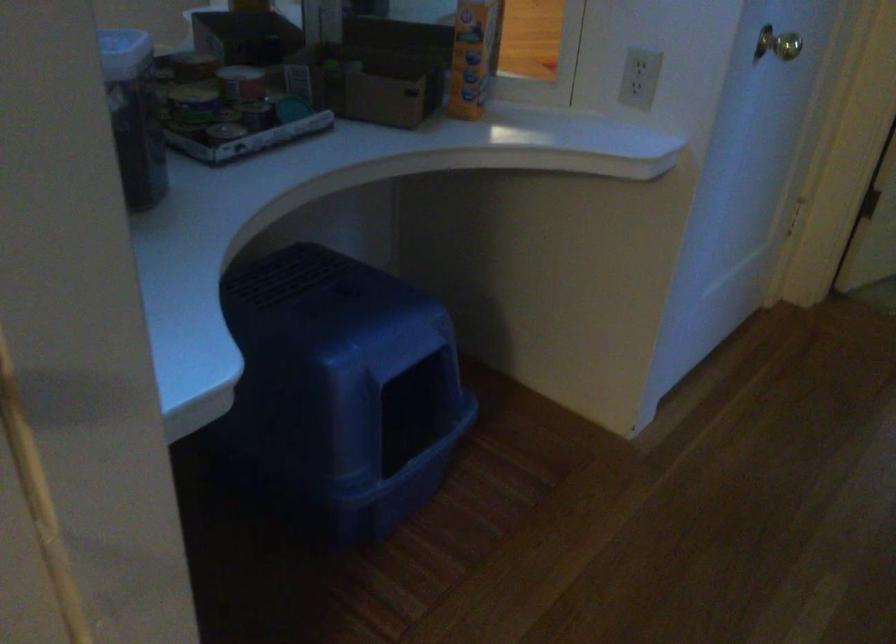
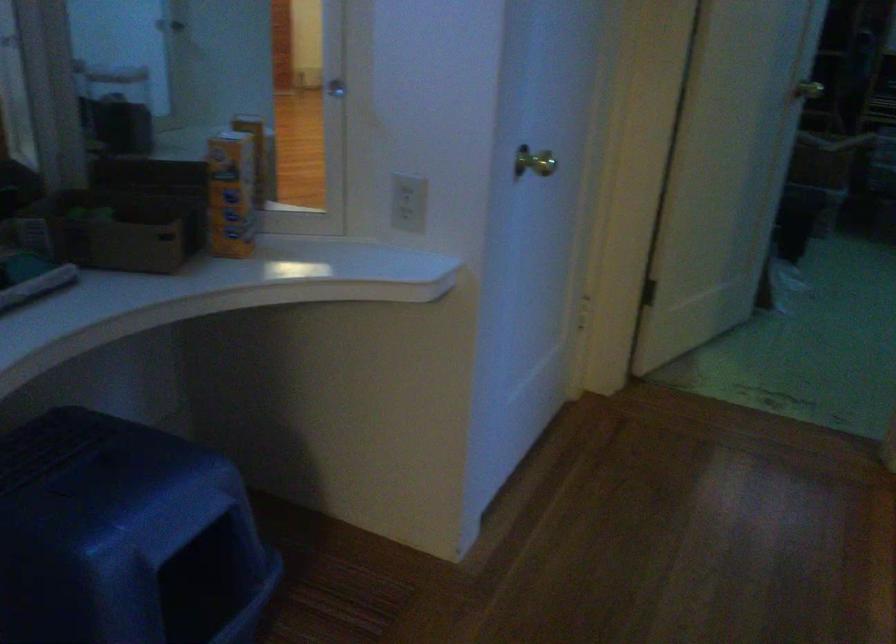
Question: The camera is either moving clockwise (left) or counter-clockwise (right) around the object. The first image is from the beginning of the video and the second image is from the end. Is the camera moving left or right when shooting the video?

Choices:
 (A) Left
 (B) Right

Answer: (A)